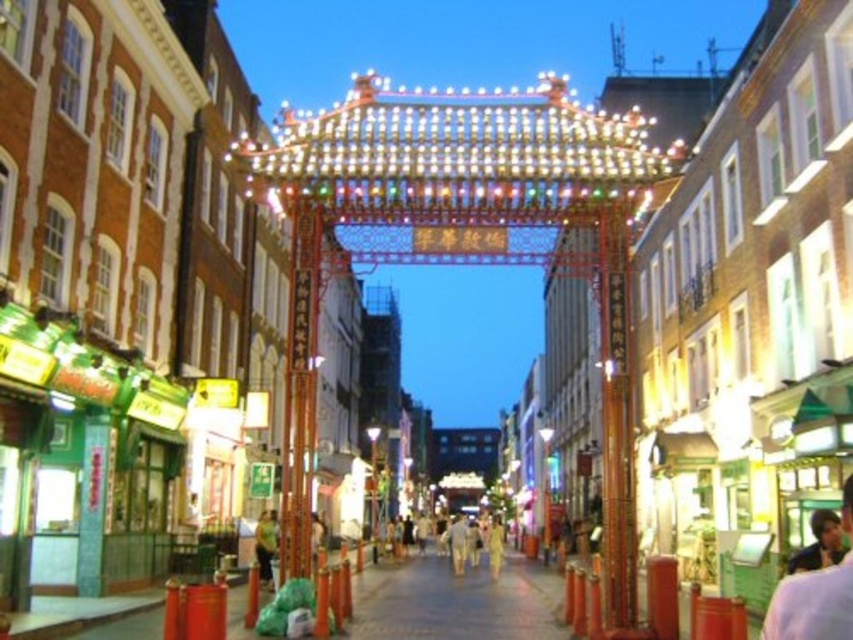
Question: Is light brown leather jacket at lower right bigger than light beige cotton pants at center?

Choices:
 (A) yes
 (B) no

Answer: (B)

Question: Which of the following is the farthest from the observer?

Choices:
 (A) light brown leather jacket at lower right
 (B) light beige pants at center

Answer: (B)

Question: Which of the following is the farthest from the observer?

Choices:
 (A) light brown leather jacket at lower right
 (B) light beige cotton pants at center

Answer: (B)

Question: Can you confirm if light beige pants at center is wider than light beige cotton pants at center?

Choices:
 (A) no
 (B) yes

Answer: (B)

Question: Does light beige pants at center appear over light beige cotton pants at center?

Choices:
 (A) yes
 (B) no

Answer: (A)

Question: Based on their relative distances, which object is farther from the light beige cotton pants at center?

Choices:
 (A) light brown leather jacket at lower right
 (B) light beige pants at center

Answer: (A)